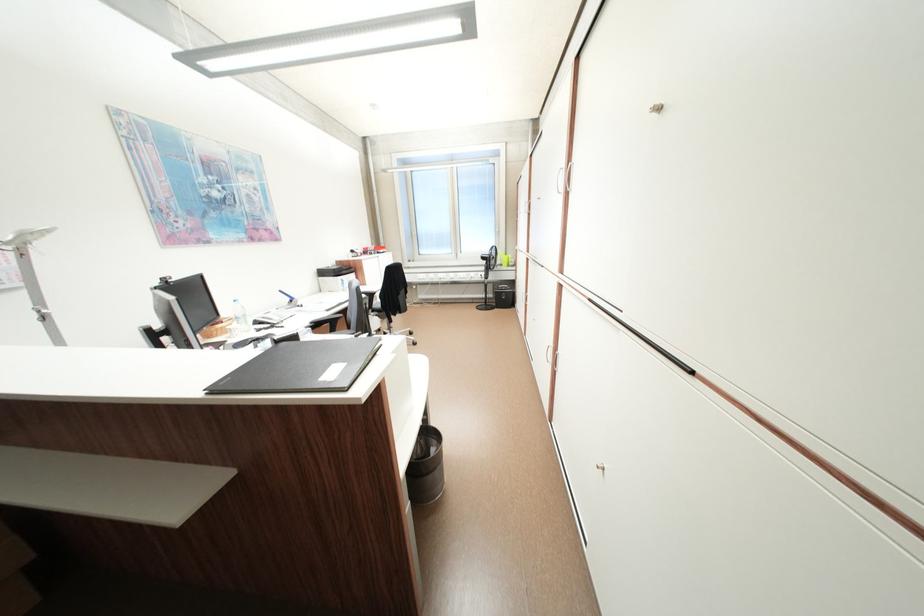
Image resolution: width=924 pixels, height=616 pixels. What do you see at coordinates (343, 334) in the screenshot? I see `the chair sitting surface` at bounding box center [343, 334].